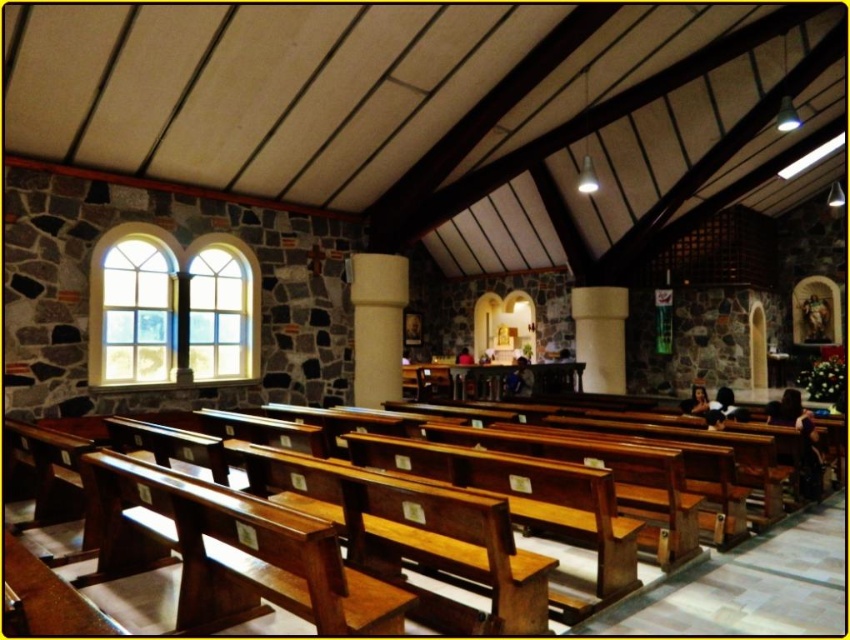
Does point (774, 579) come in front of point (378, 346)?

That is True.

Between point (819, 509) and point (397, 392), which one is positioned in front?

Point (819, 509)

In order to click on wooden bench at center in this screenshot , I will do `click(743, 586)`.

Which is more to the left, white smooth column at center or white smooth pillar at center?

white smooth column at center

Does white smooth column at center have a smaller size compared to white smooth pillar at center?

Yes, white smooth column at center is smaller than white smooth pillar at center.

Locate an element on the screen. The height and width of the screenshot is (640, 850). white smooth column at center is located at coordinates (377, 324).

Locate an element on the screen. The image size is (850, 640). white smooth column at center is located at coordinates (377, 324).

Between clear glass window at upper left and white smooth pillar at center, which one is positioned higher?

clear glass window at upper left is higher up.

Who is more forward, [239,248] or [586,355]?

Point [239,248] is more forward.

This screenshot has height=640, width=850. What are the coordinates of `clear glass window at upper left` in the screenshot? It's located at (173, 308).